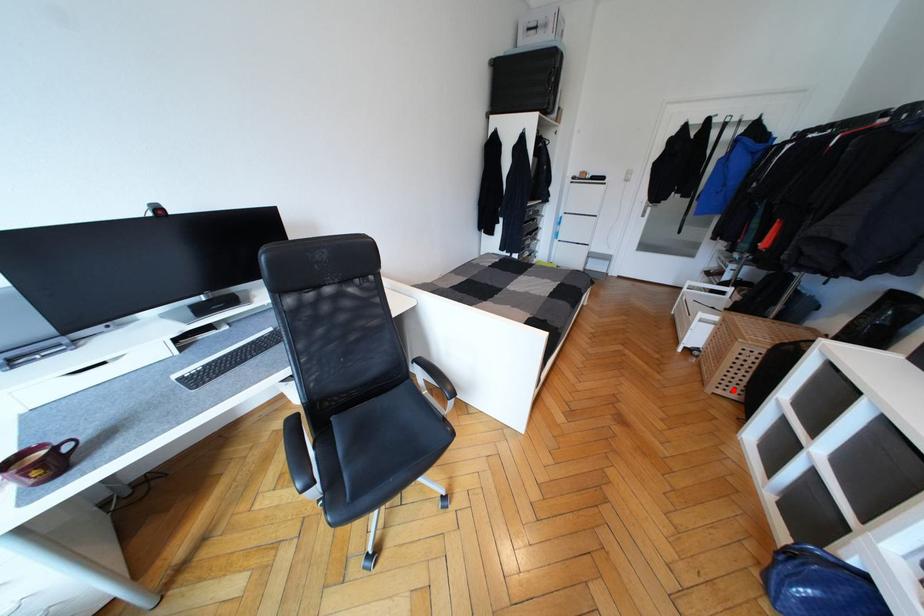
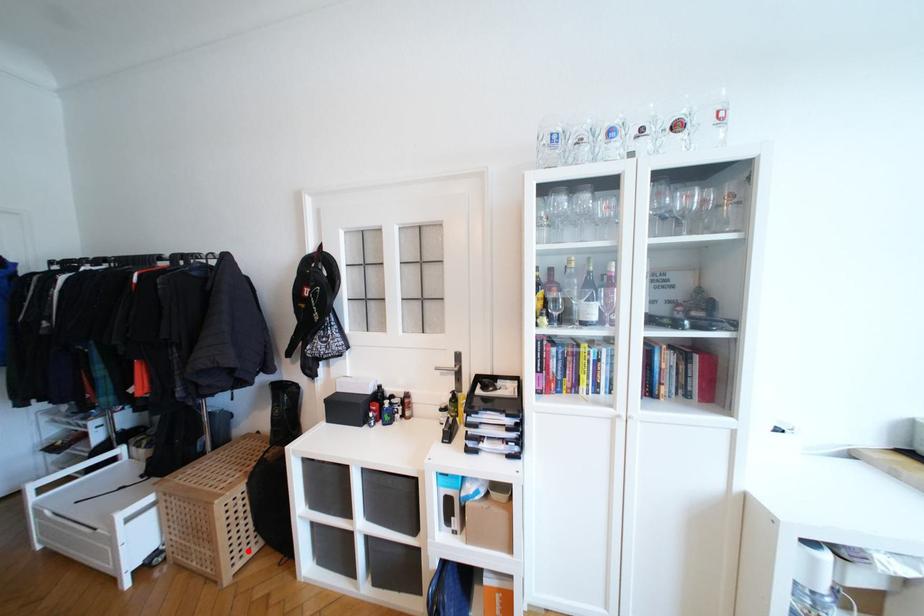
I am providing you with two images of the same scene from different viewpoints. A red point is marked on the first image and another point is marked on the second image. Does the point marked in image1 correspond to the same location as the one in image2?

Yes